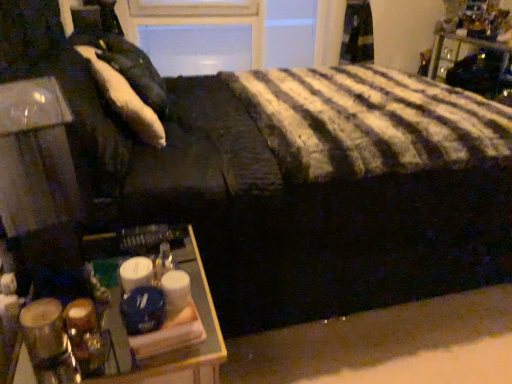
What is the approximate height of metallic black nightstand at upper right?

The height of metallic black nightstand at upper right is 9.28 inches.

Locate an element on the screen. white soft pillow at upper left is located at coordinates (125, 99).

Does wooden tray at lower left have a smaller size compared to metallic black nightstand at upper right?

Actually, wooden tray at lower left might be larger than metallic black nightstand at upper right.

From the image's perspective, which object appears higher, wooden tray at lower left or metallic black nightstand at upper right?

metallic black nightstand at upper right appears higher in the image.

How different are the orientations of wooden tray at lower left and metallic black nightstand at upper right in degrees?

They differ by 178 degrees in their facing directions.

Who is taller, wooden tray at lower left or metallic black nightstand at upper right?

Standing taller between the two is wooden tray at lower left.

Could you tell me if wooden tray at lower left is facing white soft pillow at upper left?

No.

Are wooden tray at lower left and white soft pillow at upper left located far from each other?

No, wooden tray at lower left is not far away from white soft pillow at upper left.

Between point (180, 253) and point (130, 95), which one is positioned behind?

The point (130, 95) is behind.

From the image's perspective, which object appears higher, wooden tray at lower left or white soft pillow at upper left?

white soft pillow at upper left appears higher in the image.

Which object is further away from the camera taking this photo, white soft pillow at upper left or wooden tray at lower left?

white soft pillow at upper left is further away from the camera.

Could you tell me if white soft pillow at upper left is turned towards wooden tray at lower left?

No, white soft pillow at upper left is not aimed at wooden tray at lower left.

Would you say white soft pillow at upper left is inside or outside wooden tray at lower left?

white soft pillow at upper left is located beyond the bounds of wooden tray at lower left.

Considering the relative sizes of white soft pillow at upper left and wooden tray at lower left in the image provided, is white soft pillow at upper left wider than wooden tray at lower left?

Incorrect, the width of white soft pillow at upper left does not surpass that of wooden tray at lower left.

Is white soft pillow at upper left wider than metallic black nightstand at upper right?

Incorrect, the width of white soft pillow at upper left does not surpass that of metallic black nightstand at upper right.

Is white soft pillow at upper left positioned far away from metallic black nightstand at upper right?

Yes, white soft pillow at upper left and metallic black nightstand at upper right are located far from each other.

Does white soft pillow at upper left turn towards metallic black nightstand at upper right?

Yes, white soft pillow at upper left is turned towards metallic black nightstand at upper right.

Based on the photo, in the image, is white soft pillow at upper left on the left side or the right side of metallic black nightstand at upper right?

Based on their positions, white soft pillow at upper left is located to the left of metallic black nightstand at upper right.

Between metallic black nightstand at upper right and wooden tray at lower left, which one has larger size?

wooden tray at lower left.

From the image's perspective, is metallic black nightstand at upper right on wooden tray at lower left?

Yes.

Is metallic black nightstand at upper right oriented away from wooden tray at lower left?

That's not correct — metallic black nightstand at upper right is not looking away from wooden tray at lower left.

Can you confirm if metallic black nightstand at upper right is thinner than white soft pillow at upper left?

No, metallic black nightstand at upper right is not thinner than white soft pillow at upper left.

Which point is more forward, (504, 59) or (113, 90)?

Positioned in front is point (113, 90).

Does metallic black nightstand at upper right come behind white soft pillow at upper left?

Yes, metallic black nightstand at upper right is behind white soft pillow at upper left.

Can you confirm if metallic black nightstand at upper right is smaller than white soft pillow at upper left?

Correct, metallic black nightstand at upper right occupies less space than white soft pillow at upper left.

The height and width of the screenshot is (384, 512). I want to click on table that appears on the left of metallic black nightstand at upper right, so click(185, 348).

You are a GUI agent. You are given a task and a screenshot of the screen. Output one action in this format:
    pyautogui.click(x=<x>, y=<y>)
    Task: Click on the pillow above the wooden tray at lower left (from the image's perspective)
    
    Given the screenshot: What is the action you would take?
    pyautogui.click(x=125, y=99)

Which object lies further to the anchor point wooden tray at lower left, white soft pillow at upper left or metallic black nightstand at upper right?

metallic black nightstand at upper right lies further to wooden tray at lower left than the other object.

When comparing their distances from metallic black nightstand at upper right, does wooden tray at lower left or white soft pillow at upper left seem closer?

white soft pillow at upper left is positioned closer to the anchor metallic black nightstand at upper right.

Which object lies nearer to the anchor point white soft pillow at upper left, metallic black nightstand at upper right or wooden tray at lower left?

Based on the image, wooden tray at lower left appears to be nearer to white soft pillow at upper left.

Looking at the image, which one is located closer to wooden tray at lower left, metallic black nightstand at upper right or white soft pillow at upper left?

Based on the image, white soft pillow at upper left appears to be nearer to wooden tray at lower left.

Estimate the real-world distances between objects in this image. Which object is closer to metallic black nightstand at upper right, white soft pillow at upper left or wooden tray at lower left?

Among the two, white soft pillow at upper left is located nearer to metallic black nightstand at upper right.

Based on their spatial positions, is wooden tray at lower left or metallic black nightstand at upper right further from white soft pillow at upper left?

metallic black nightstand at upper right lies further to white soft pillow at upper left than the other object.

This screenshot has width=512, height=384. I want to click on table between white soft pillow at upper left and metallic black nightstand at upper right in the horizontal direction, so click(185, 348).